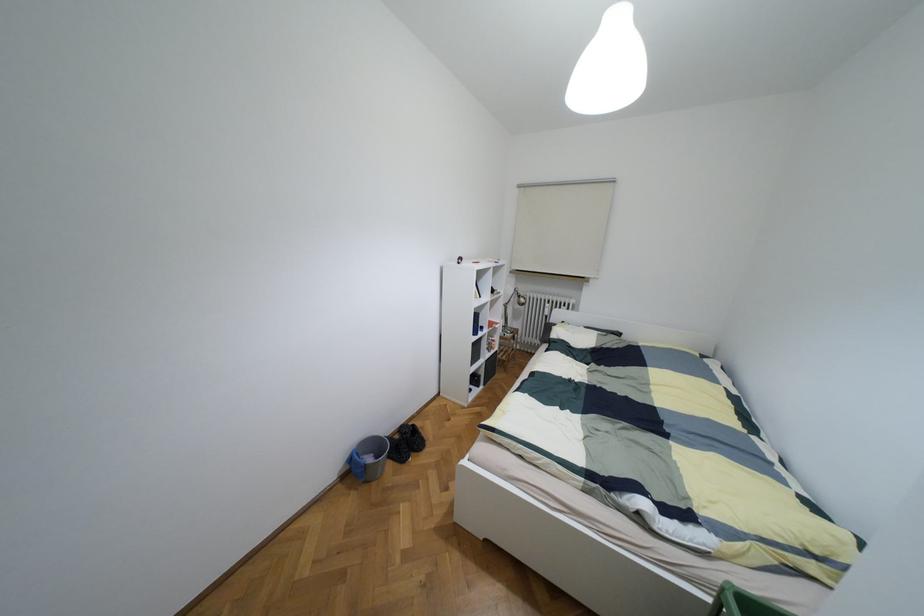
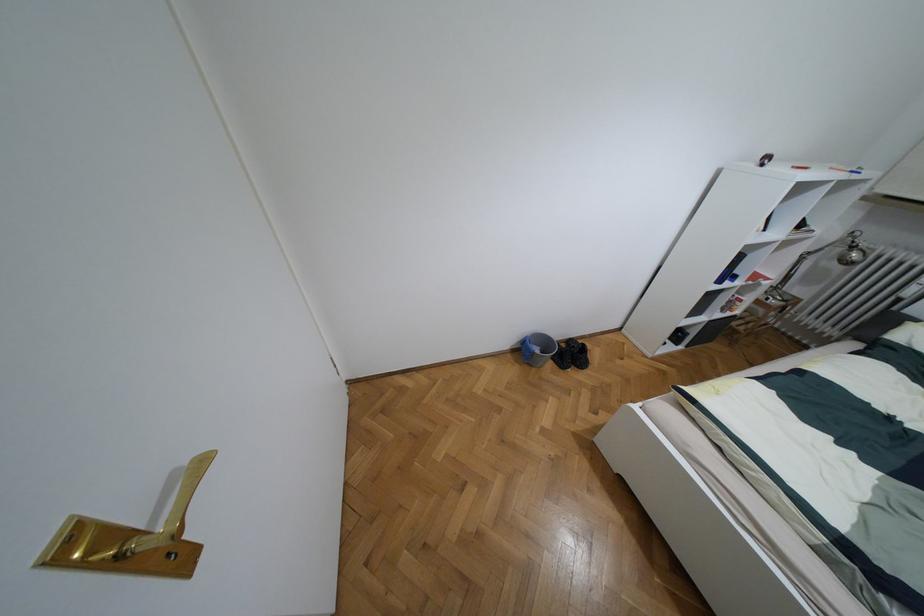
Where in the second image is the point corresponding to (x=412, y=424) from the first image?

(582, 344)